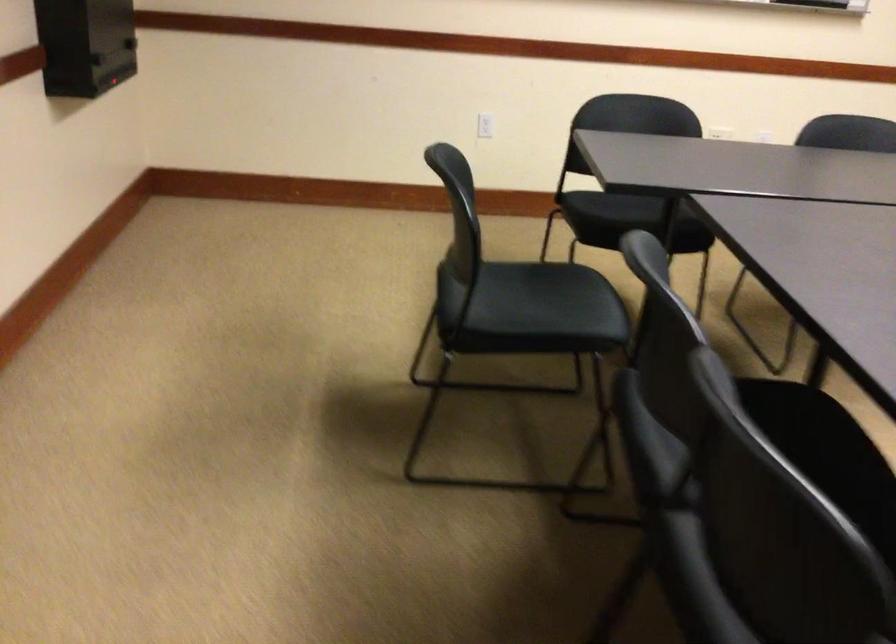
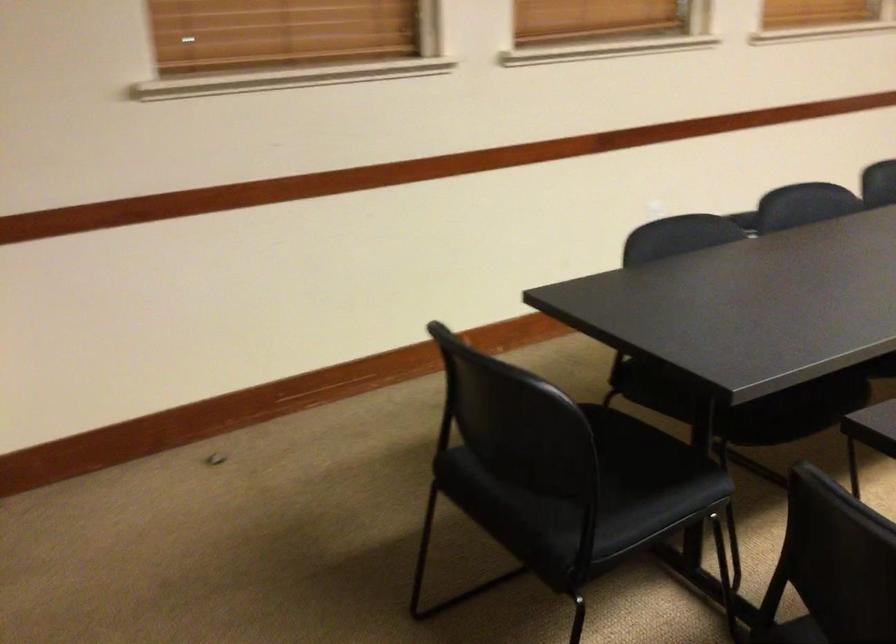
Question: What movement of the cameraman would produce the second image?

Choices:
 (A) Left
 (B) Right
 (C) Forward
 (D) Backward

Answer: (D)